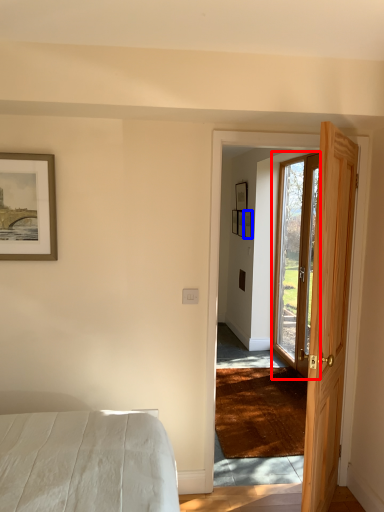
Question: Which object is further to the camera taking this photo, door (highlighted by a red box) or picture frame (highlighted by a blue box)?

Choices:
 (A) door
 (B) picture frame

Answer: (B)